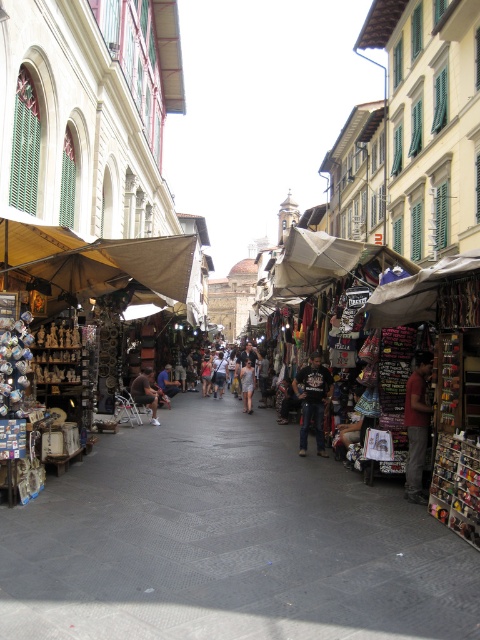
You are a delivery person carrying a large box that is 1.5 meters long. You need to place it on the smooth gray pavement at center or the brown leather bag at center. Which location can accommodate the box without exceeding its length?

The smooth gray pavement at center is 15.46 meters from the brown leather bag at center. Since the box is 1.5 meters long, it can fit on the smooth gray pavement at center as the distance between the two objects is sufficient. However, the brown leather bag at center is likely too small to accommodate the box. Therefore, place the box on the smooth gray pavement at center.

You are a traveler shopping at the market and want to buy both the black cotton shirt at center and the dark blue jeans at center. If you have a small backpack, which item might not fit if you try to pack them together?

The dark blue jeans at center might not fit in the backpack because it is larger than the black cotton shirt at center.